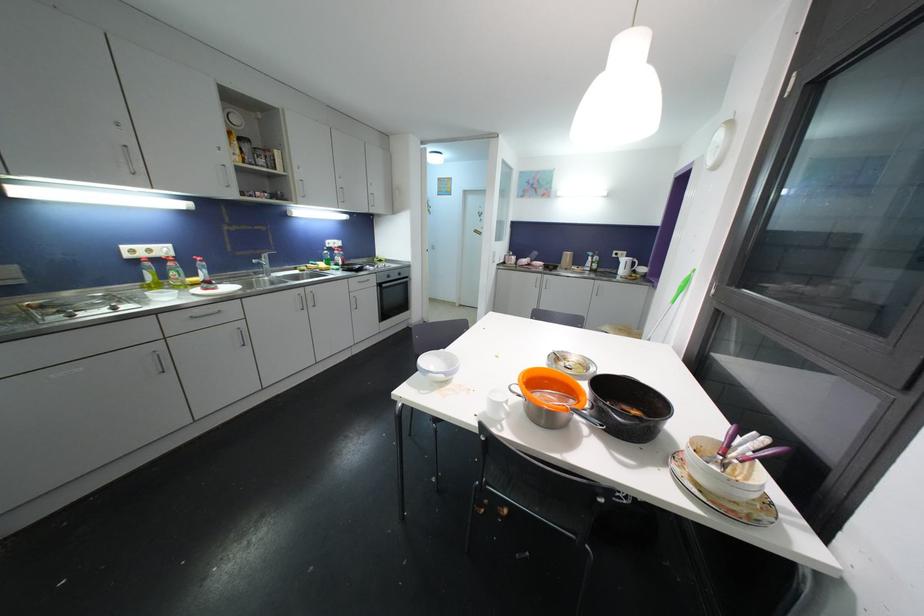
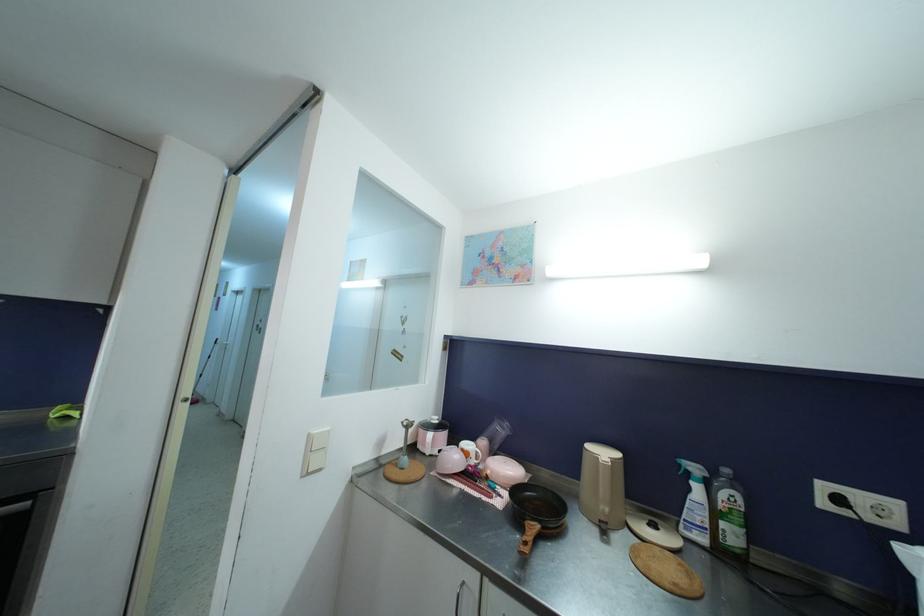
Locate, in the second image, the point that corresponds to pixel 593 256 in the first image.

(699, 472)